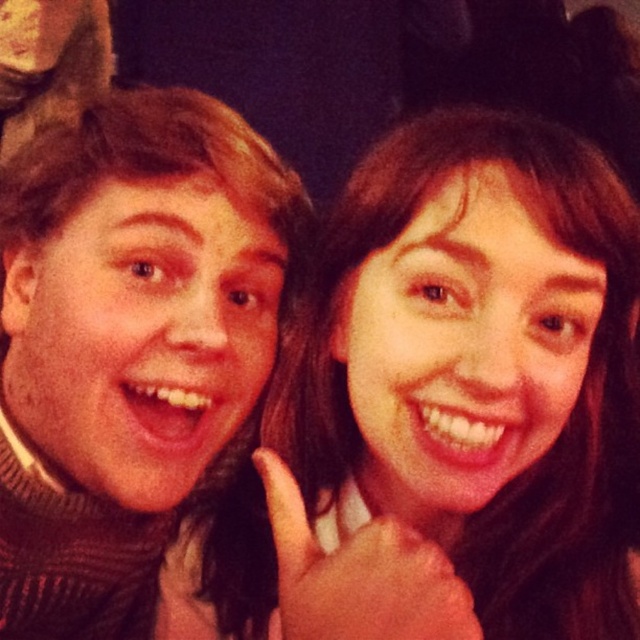
Between matte brown sweater at left and smooth skin hand at center, which one has less height?

With less height is smooth skin hand at center.

The image size is (640, 640). What do you see at coordinates (132, 337) in the screenshot?
I see `matte brown sweater at left` at bounding box center [132, 337].

Which is in front, point (131, 147) or point (292, 595)?

Point (292, 595) is more forward.

Locate an element on the screen. matte brown sweater at left is located at coordinates (132, 337).

Does smooth skin face at center have a larger size compared to smooth skin hand at center?

Yes.

What are the coordinates of `smooth skin face at center` in the screenshot? It's located at 449,392.

Identify the location of smooth skin face at center. (449, 392).

Does smooth skin face at center have a lesser width compared to matte brown sweater at left?

No.

Where is `smooth skin face at center`? The height and width of the screenshot is (640, 640). smooth skin face at center is located at coordinates (449, 392).